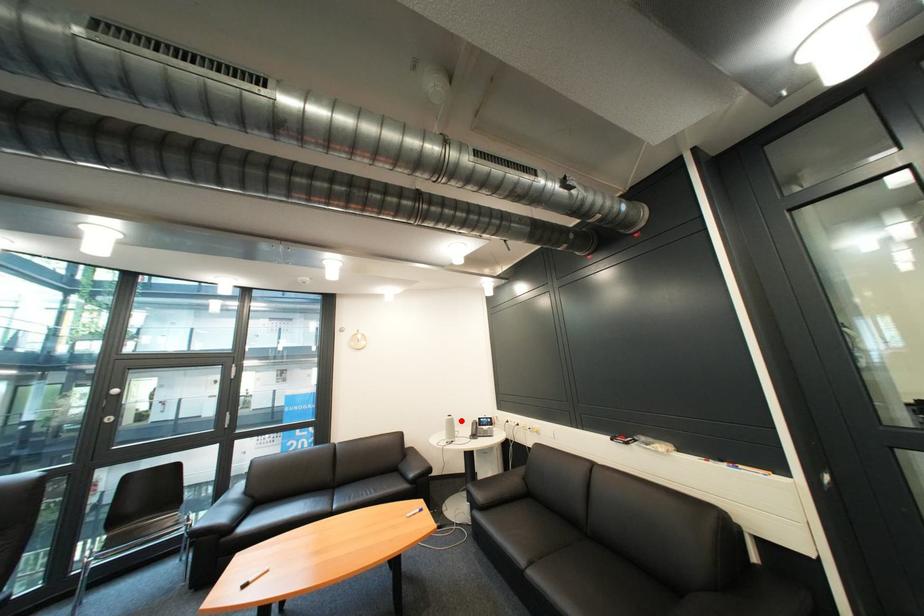
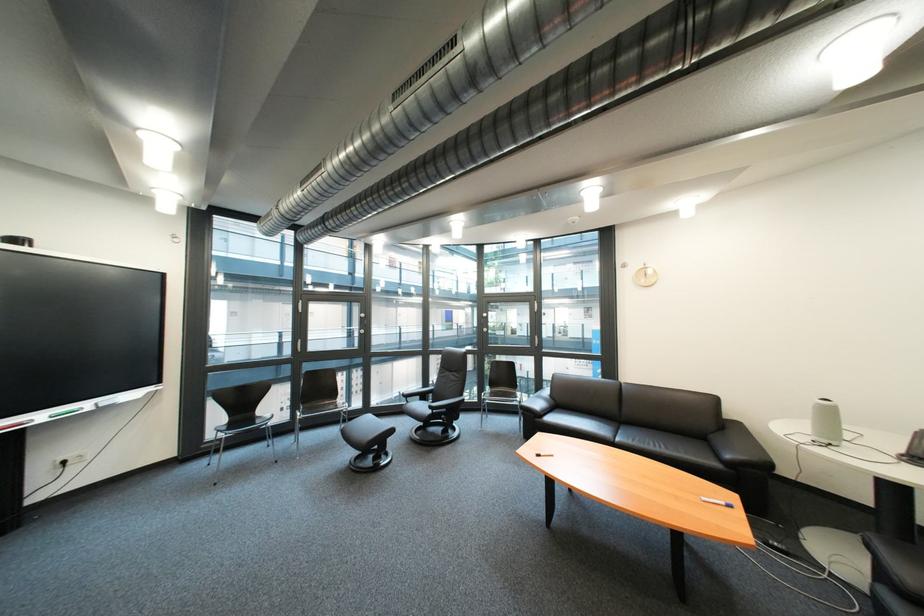
In the second image, find the point that corresponds to the highlighted location in the first image.

(833, 406)